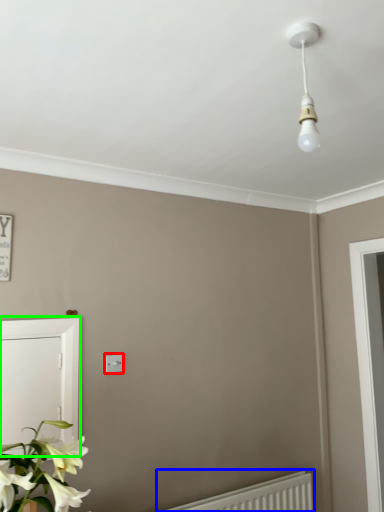
Question: Which object is positioned farthest from light switch (highlighted by a red box)? Select from radiator (highlighted by a blue box) and screen door (highlighted by a green box).

Choices:
 (A) radiator
 (B) screen door

Answer: (A)